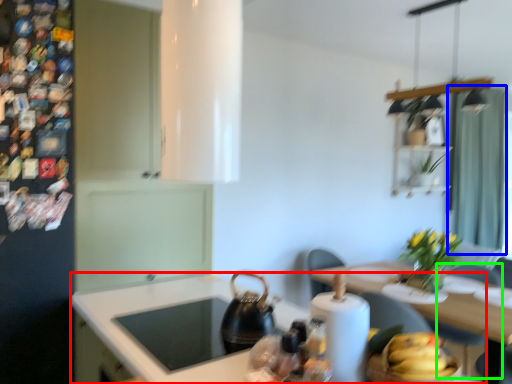
Question: Considering the real-world distances, which object is farthest from counter top (highlighted by a red box)? curtain (highlighted by a blue box) or chair (highlighted by a green box)?

Choices:
 (A) curtain
 (B) chair

Answer: (A)